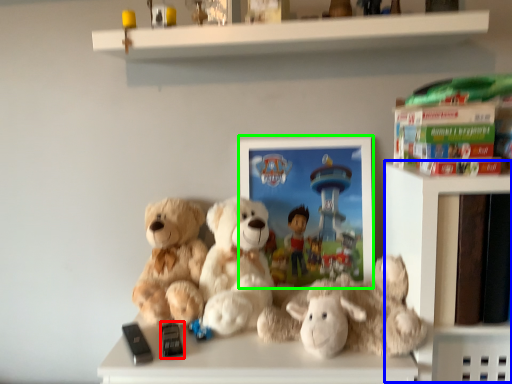
Question: Which object is positioned farthest from toy (highlighted by a red box)? Select from shelf (highlighted by a blue box) and picture frame (highlighted by a green box).

Choices:
 (A) shelf
 (B) picture frame

Answer: (A)